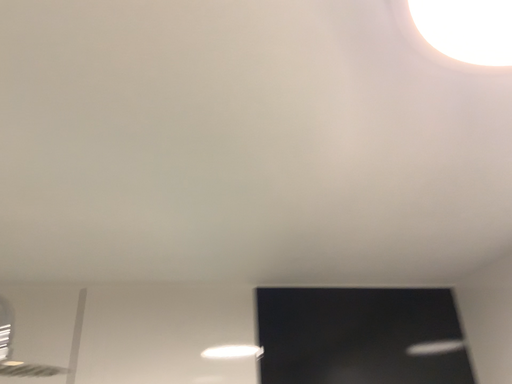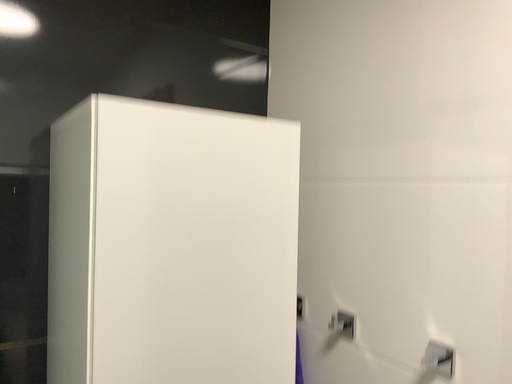
Question: Which way did the camera rotate in the video?

Choices:
 (A) rotated left
 (B) rotated right

Answer: (B)